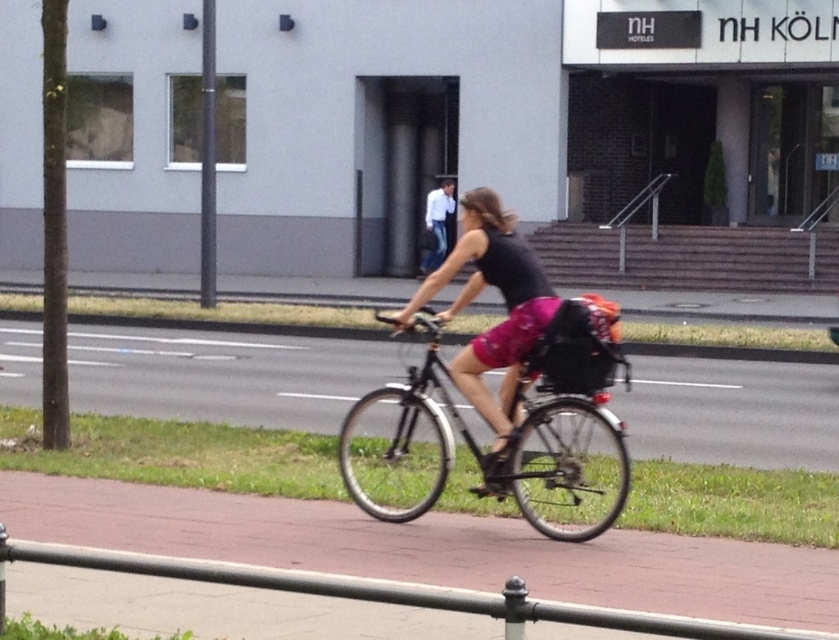
Question: Which point appears farthest from the camera in this image?

Choices:
 (A) (446, 243)
 (B) (399, 458)
 (C) (524, 257)
 (D) (540, 609)

Answer: (A)

Question: Which of the following is the farthest from the observer?

Choices:
 (A) (676, 628)
 (B) (417, 371)
 (C) (482, 212)
 (D) (431, 269)

Answer: (D)

Question: Can you confirm if shiny black bicycle at center is positioned above matte black tank top at center?

Choices:
 (A) yes
 (B) no

Answer: (B)

Question: Which of these objects is positioned farthest from the shiny black bicycle at center?

Choices:
 (A) black metal rail at lower center
 (B) matte black tank top at center

Answer: (A)

Question: Does black metal rail at lower center appear on the right side of white cotton shirt at center?

Choices:
 (A) no
 (B) yes

Answer: (B)

Question: Can you confirm if shiny black bicycle at center is smaller than matte black tank top at center?

Choices:
 (A) yes
 (B) no

Answer: (A)